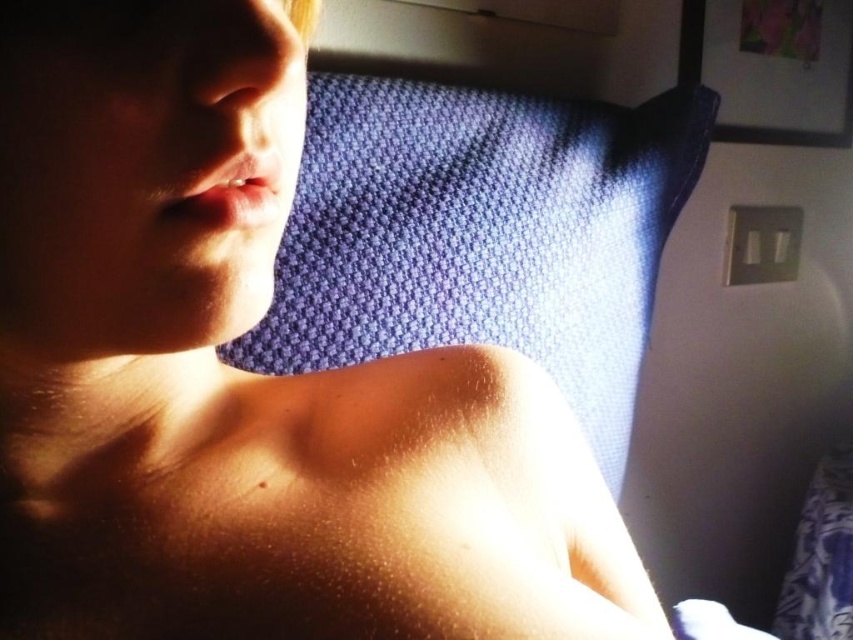
You are a photographer adjusting your camera settings to capture the scene. You notice two points marked in the image. The first point is at coordinate point [111,394] and the second is at point [325,342]. Based on their positions, which point is closer to the camera lens?

Point [111,394] is in front of point [325,342], so it is closer to the camera lens.

You are a photographer adjusting lighting for a portrait. The subject is lying down with sunlight creating contrast. There is a point at coordinates (305, 502). Based on the scene description, what is the texture of the surface at that point?

The point at coordinates (305, 502) corresponds to smooth skin at center, so the texture there is smooth.

Based on the scene description, where is the smooth skin at center located in terms of coordinates?

The smooth skin at center is located at point coordinates of (305, 502).